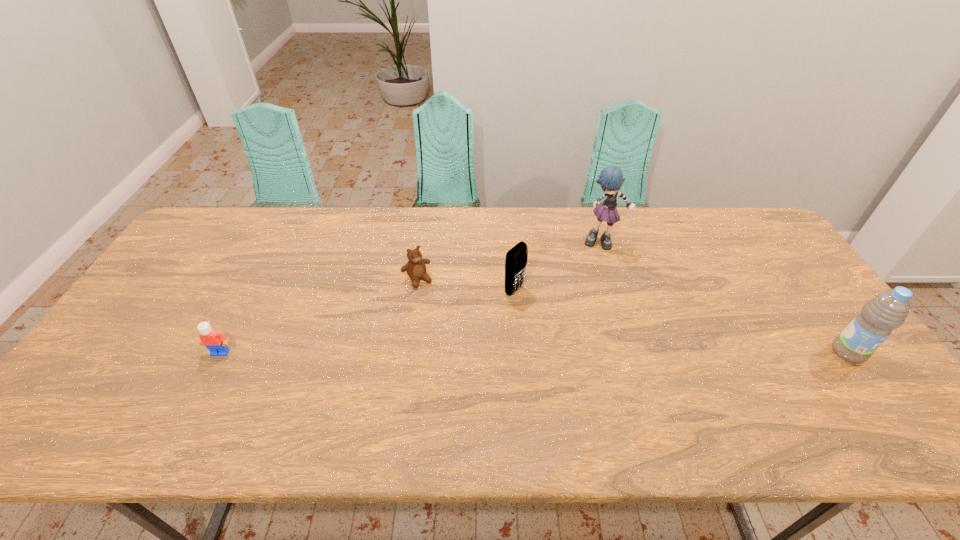
Identify the location of vacant area that lies between the rightmost object and the teddy bear. The width and height of the screenshot is (960, 540). (633, 316).

Where is `free space that is in between the fourth object from right to left and the rightmost object`? The width and height of the screenshot is (960, 540). free space that is in between the fourth object from right to left and the rightmost object is located at coordinates (633, 316).

Find the location of a particular element. unoccupied area between the second object from right to left and the Lego is located at coordinates (412, 298).

Identify the location of empty location between the rightmost object and the rag doll. The width and height of the screenshot is (960, 540). (726, 298).

I want to click on vacant space that's between the third tallest object and the fourth object from left to right, so pyautogui.click(x=559, y=266).

Find the location of a particular element. vacant area that lies between the Lego and the teddy bear is located at coordinates (319, 316).

Point out which object is positioned as the second nearest to the second tallest object. Please provide its 2D coordinates. Your answer should be formatted as a tuple, i.e. [(x, y)], where the tuple contains the x and y coordinates of a point satisfying the conditions above.

[(516, 259)]

Identify the location of object that is the closest one to the third shortest object. The image size is (960, 540). (416, 269).

Find the location of a particular element. This screenshot has width=960, height=540. vacant region that satisfies the following two spatial constraints: 1. on the face of the water bottle; 2. on the left side of the leftmost object is located at coordinates point(221,353).

Where is `vacant space that satisfies the following two spatial constraints: 1. on the face of the fourth shortest object; 2. on the left side of the leftmost object`? This screenshot has height=540, width=960. vacant space that satisfies the following two spatial constraints: 1. on the face of the fourth shortest object; 2. on the left side of the leftmost object is located at coordinates (221, 353).